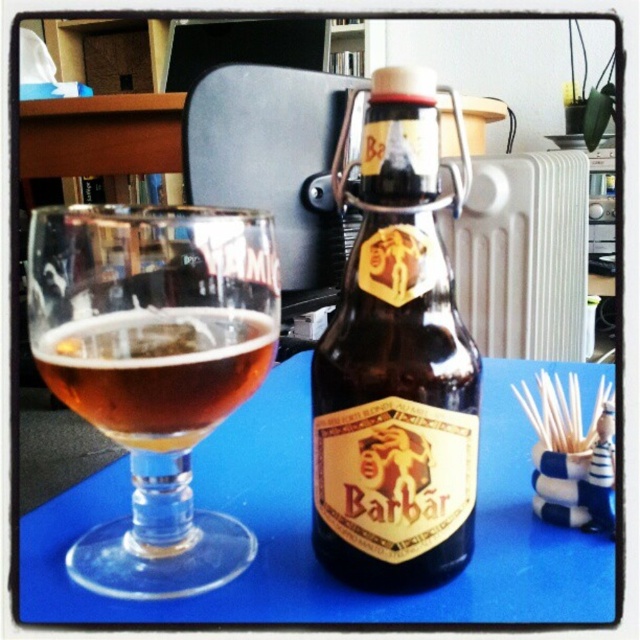
Question: Which point appears closest to the camera in this image?

Choices:
 (A) (408, 480)
 (B) (109, 225)
 (C) (99, 470)
 (D) (140, 364)

Answer: (B)

Question: Does brown glass bottle at center have a larger size compared to white metallic radiator at center right?

Choices:
 (A) yes
 (B) no

Answer: (B)

Question: Which object appears closest to the camera in this image?

Choices:
 (A) transparent glass wine glass at left
 (B) white metallic radiator at center right

Answer: (A)

Question: Among these objects, which one is nearest to the camera?

Choices:
 (A) brown glass bottle at center
 (B) white metallic radiator at center right
 (C) blue matte table at center
 (D) amber glass at center

Answer: (A)

Question: Does transparent glass wine glass at left appear on the left side of amber glass at center?

Choices:
 (A) yes
 (B) no

Answer: (A)

Question: Is transparent glass wine glass at left further to camera compared to amber glass at center?

Choices:
 (A) yes
 (B) no

Answer: (B)